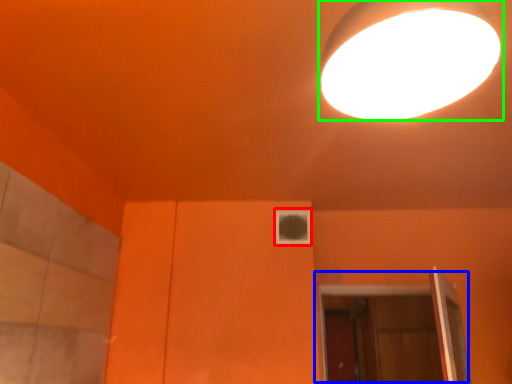
Question: Based on their relative distances, which object is farther from window (highlighted by a red box)? Choose from door (highlighted by a blue box) and lamp (highlighted by a green box).

Choices:
 (A) door
 (B) lamp

Answer: (B)